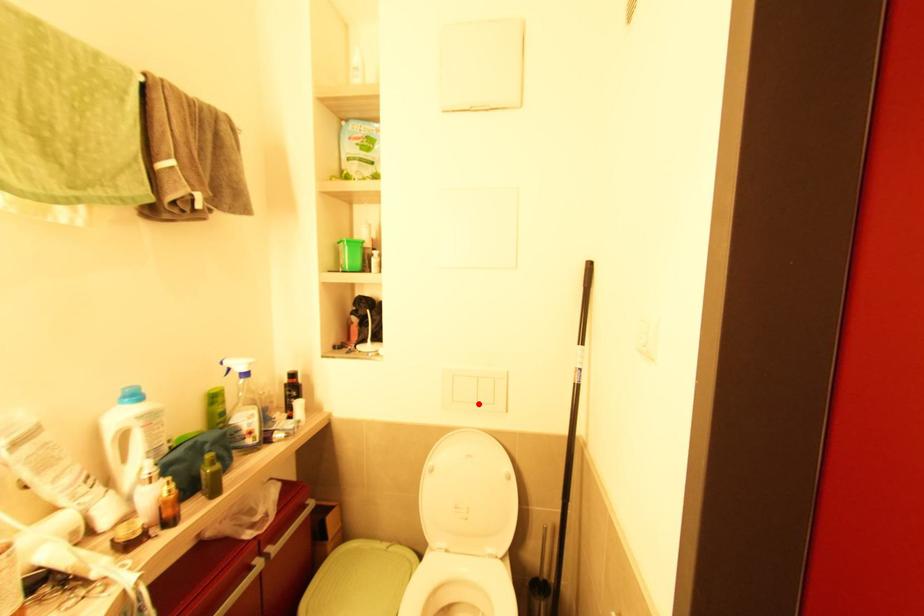
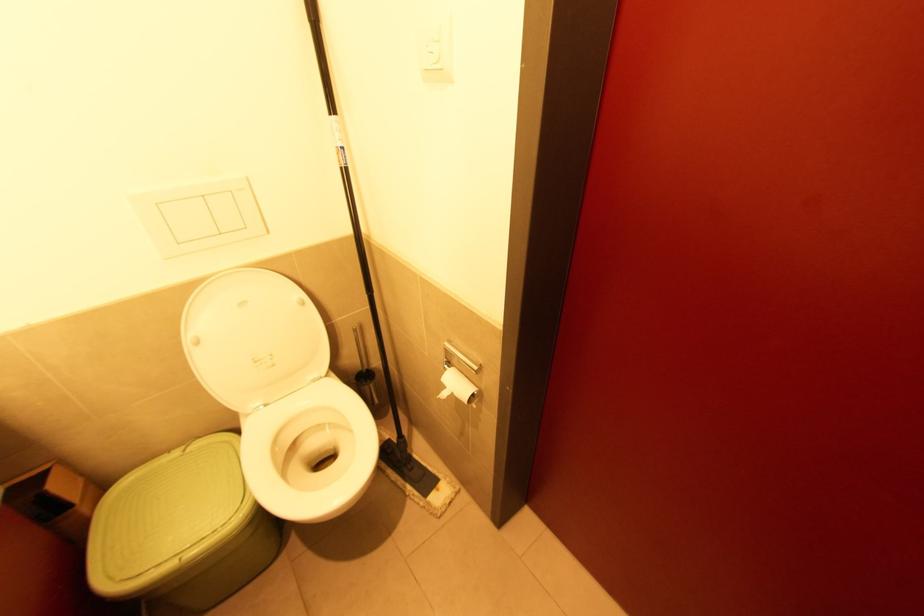
Find the pixel in the second image that matches the highlighted location in the first image.

(224, 235)